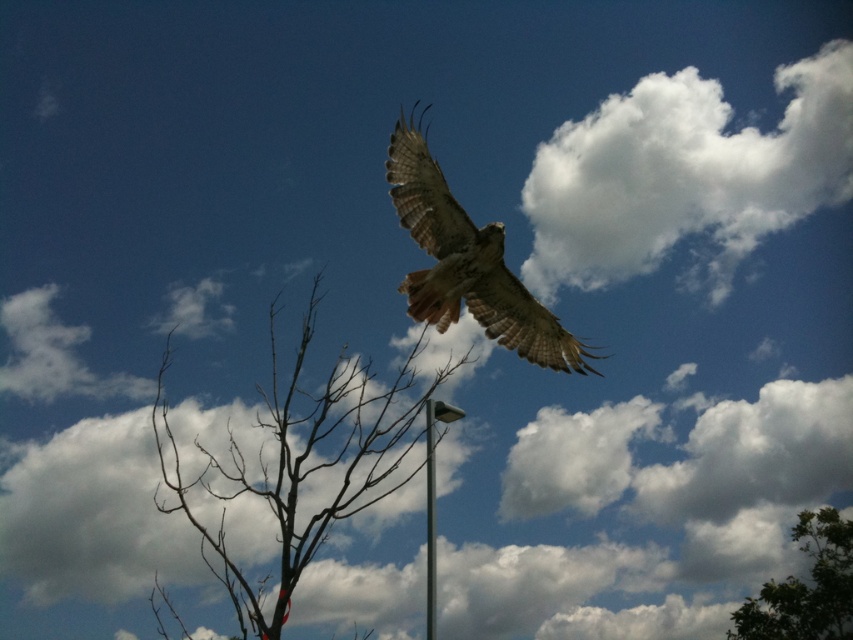
Which is below, white fluffy cloud at upper right or silver metallic pole at center?

silver metallic pole at center is below.

At what (x,y) coordinates should I click in order to perform the action: click on white fluffy cloud at upper right. Please return your answer as a coordinate pair (x, y). Looking at the image, I should click on (683, 173).

This screenshot has height=640, width=853. Describe the element at coordinates (683, 173) in the screenshot. I see `white fluffy cloud at upper right` at that location.

You are a GUI agent. You are given a task and a screenshot of the screen. Output one action in this format:
    pyautogui.click(x=<x>, y=<y>)
    Task: Click on the white fluffy cloud at upper right
    The image size is (853, 640).
    Given the screenshot: What is the action you would take?
    pyautogui.click(x=683, y=173)

Who is shorter, silver metallic pole at center or metallic gray pole at center?

With less height is metallic gray pole at center.

Which of these two, silver metallic pole at center or metallic gray pole at center, stands taller?

With more height is silver metallic pole at center.

Between point (428, 596) and point (430, 400), which one is positioned in front?

Point (428, 596) is more forward.

This screenshot has width=853, height=640. I want to click on silver metallic pole at center, so click(x=433, y=500).

Who is taller, white fluffy cloud at upper right or brown/dry wood tree at center-left?

With more height is brown/dry wood tree at center-left.

Can you confirm if white fluffy cloud at upper right is positioned to the left of brown/dry wood tree at center-left?

Incorrect, white fluffy cloud at upper right is not on the left side of brown/dry wood tree at center-left.

Is point (579, 184) positioned in front of point (412, 353)?

No, (579, 184) is behind (412, 353).

Image resolution: width=853 pixels, height=640 pixels. I want to click on white fluffy cloud at upper right, so click(x=683, y=173).